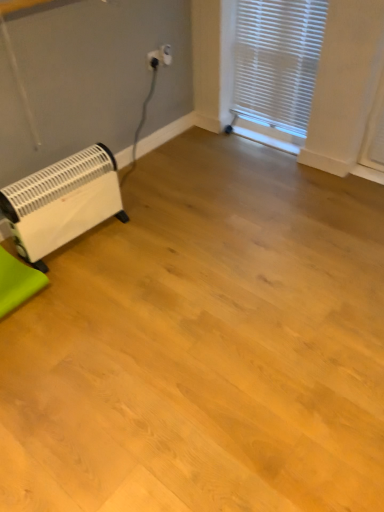
Question: Should I look upward or downward to see green fabric at lower left?

Choices:
 (A) up
 (B) down

Answer: (B)

Question: Does white plastic electric outlet at upper center appear on the right side of green fabric at lower left?

Choices:
 (A) yes
 (B) no

Answer: (A)

Question: From a real-world perspective, is white plastic electric outlet at upper center beneath green fabric at lower left?

Choices:
 (A) no
 (B) yes

Answer: (A)

Question: Does white plastic electric outlet at upper center come in front of green fabric at lower left?

Choices:
 (A) yes
 (B) no

Answer: (B)

Question: From a real-world perspective, is white plastic electric outlet at upper center on top of green fabric at lower left?

Choices:
 (A) no
 (B) yes

Answer: (B)

Question: Is white plastic electric outlet at upper center bigger than green fabric at lower left?

Choices:
 (A) yes
 (B) no

Answer: (B)

Question: Can you confirm if white plastic electric outlet at upper center is wider than green fabric at lower left?

Choices:
 (A) yes
 (B) no

Answer: (B)

Question: From a real-world perspective, is white plastic blinds at upper right located beneath white plastic electric outlet at upper center?

Choices:
 (A) no
 (B) yes

Answer: (B)

Question: Is white plastic electric outlet at upper center at the back of white plastic blinds at upper right?

Choices:
 (A) no
 (B) yes

Answer: (A)

Question: Does white plastic blinds at upper right appear on the left side of white plastic electric outlet at upper center?

Choices:
 (A) no
 (B) yes

Answer: (A)

Question: Is the depth of white plastic blinds at upper right less than that of white plastic electric outlet at upper center?

Choices:
 (A) no
 (B) yes

Answer: (B)

Question: From a real-world perspective, is white plastic blinds at upper right positioned over white plastic electric outlet at upper center based on gravity?

Choices:
 (A) yes
 (B) no

Answer: (B)

Question: Considering the relative sizes of white plastic blinds at upper right and white plastic electric outlet at upper center in the image provided, is white plastic blinds at upper right wider than white plastic electric outlet at upper center?

Choices:
 (A) yes
 (B) no

Answer: (A)

Question: Considering the relative sizes of green fabric at lower left and white plastic heater at lower left in the image provided, is green fabric at lower left bigger than white plastic heater at lower left?

Choices:
 (A) yes
 (B) no

Answer: (B)